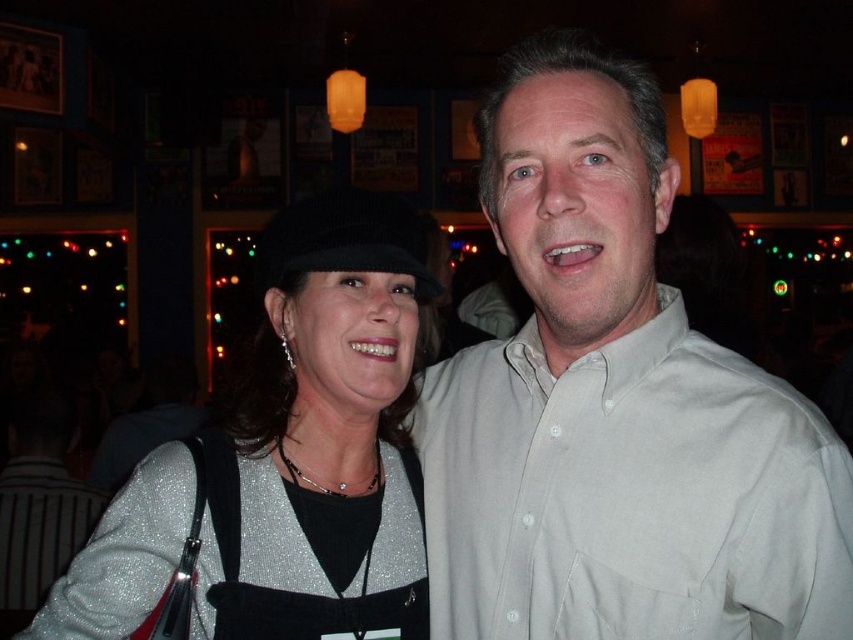
You are at a party and want to take a photo of both the light gray cotton shirt at center and the smooth beige shirt at center. Since you can only focus on one shirt at a time, which one should you focus on first to ensure the other is still in the frame?

You should focus on the smooth beige shirt at center first because the light gray cotton shirt at center is to the right of it, so adjusting the camera to include both would require framing from the leftmost point of the smooth beige shirt at center to the rightmost point of the light gray cotton shirt at center.

You are a photographer at the event and want to take a closeup shot of both the glittery fabric apron at center and the satin silver necklace at center. Since your camera can only focus on one object at a time, which object should you choose to ensure the entire object fits in the frame?

The satin silver necklace at center should be chosen because its smaller size compared to the glittery fabric apron at center ensures it will fit entirely within the camera frame.

You are a photographer at a party and need to capture a closeup shot of both the light gray cotton shirt at center and the smooth beige shirt at center. Your camera has a maximum focus range of 7 inches. Can you photograph both shirts in the same frame without moving the subjects?

The light gray cotton shirt at center is 6.91 inches away from the smooth beige shirt at center. Since the distance between them is within the camera maximum focus range of 7 inches, you can photograph both shirts in the same frame without moving the subjects.